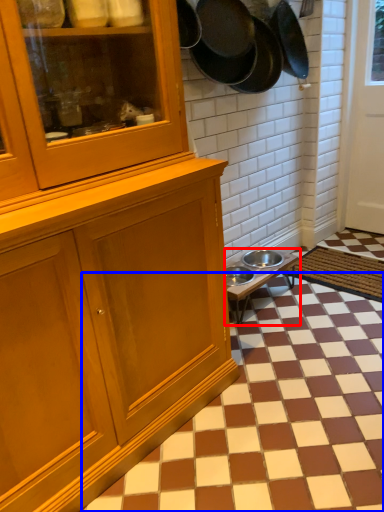
Question: Among these objects, which one is nearest to the camera, table (highlighted by a red box) or tile (highlighted by a blue box)?

Choices:
 (A) table
 (B) tile

Answer: (B)